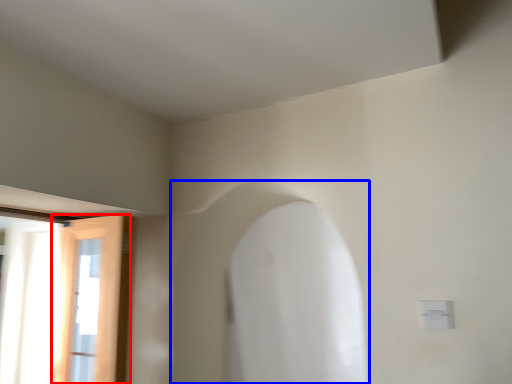
Question: Among these objects, which one is nearest to the camera, door (highlighted by a red box) or archway (highlighted by a blue box)?

Choices:
 (A) door
 (B) archway

Answer: (B)